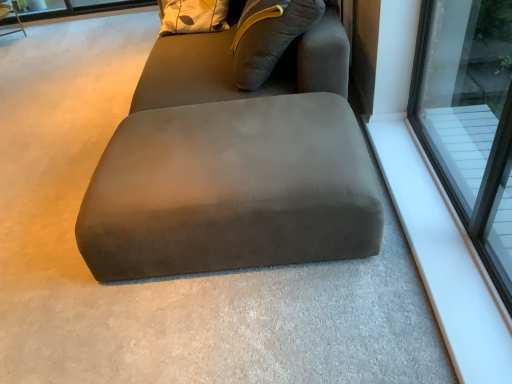
Describe the element at coordinates (232, 67) in the screenshot. I see `suede gray bean bag at center` at that location.

What is the approximate height of wooden swivel chair at upper left?

It is 12.11 inches.

In order to face transparent glass window at upper right, should I rotate leftwards or rightwards?

You should look right and rotate roughly 27.171 degrees.

Find the location of a particular element. This screenshot has height=384, width=512. white smooth window sill at upper right is located at coordinates (x=444, y=256).

Measure the distance between transparent glass window at upper right and wooden swivel chair at upper left.

transparent glass window at upper right and wooden swivel chair at upper left are 13.77 feet apart from each other.

Relative to wooden swivel chair at upper left, is transparent glass window at upper right in front or behind?

In the image, transparent glass window at upper right appears in front of wooden swivel chair at upper left.

Can you tell me how much transparent glass window at upper right and wooden swivel chair at upper left differ in facing direction?

The angle between the facing direction of transparent glass window at upper right and the facing direction of wooden swivel chair at upper left is 90.6 degrees.

Is transparent glass window at upper right far from wooden swivel chair at upper left?

Indeed, transparent glass window at upper right is not near wooden swivel chair at upper left.

Does wooden swivel chair at upper left have a smaller size compared to suede gray bean bag at center?

Yes.

Considering the sizes of wooden swivel chair at upper left and suede gray bean bag at center in the image, is wooden swivel chair at upper left wider or thinner than suede gray bean bag at center?

Considering their sizes, wooden swivel chair at upper left looks slimmer than suede gray bean bag at center.

Looking at this image, from the image's perspective, is wooden swivel chair at upper left above or below suede gray bean bag at center?

Based on their image positions, wooden swivel chair at upper left is located above suede gray bean bag at center.

Relative to suede gray bean bag at center, is wooden swivel chair at upper left in front or behind?

Clearly, wooden swivel chair at upper left is behind suede gray bean bag at center.

From a real-world perspective, is transparent glass window at upper right located beneath suede gray bean bag at center?

No, from a real-world perspective, transparent glass window at upper right is not below suede gray bean bag at center.

Would you consider transparent glass window at upper right to be distant from suede gray bean bag at center?

No.

Does point (505, 190) come behind point (343, 84)?

No, (505, 190) is closer to viewer.

From the image's perspective, is transparent glass window at upper right on top of suede gray bean bag at center?

No, from the image's perspective, transparent glass window at upper right is not above suede gray bean bag at center.

Is transparent glass window at upper right further to the viewer compared to suede ottoman at center?

No.

From the image's perspective, which object appears higher, transparent glass window at upper right or suede ottoman at center?

transparent glass window at upper right, from the image's perspective.

Based on the photo, do you think transparent glass window at upper right is within suede ottoman at center, or outside of it?

transparent glass window at upper right is located beyond the bounds of suede ottoman at center.

Is transparent glass window at upper right bigger or smaller than suede ottoman at center?

Considering their sizes, transparent glass window at upper right takes up less space than suede ottoman at center.

Considering the positions of points (434, 180) and (232, 230), is point (434, 180) farther from camera compared to point (232, 230)?

Yes, it is behind point (232, 230).

Looking at their sizes, would you say white smooth window sill at upper right is wider or thinner than suede ottoman at center?

white smooth window sill at upper right is thinner than suede ottoman at center.

Is the surface of white smooth window sill at upper right in direct contact with suede ottoman at center?

No, white smooth window sill at upper right is not with suede ottoman at center.

From the image's perspective, does white smooth window sill at upper right appear lower than suede ottoman at center?

Correct, white smooth window sill at upper right appears lower than suede ottoman at center in the image.

Is suede ottoman at center at the back of wooden swivel chair at upper left?

No, wooden swivel chair at upper left is not facing the opposite direction of suede ottoman at center.

Choose the correct answer: Is wooden swivel chair at upper left inside suede ottoman at center or outside it?

wooden swivel chair at upper left lies outside suede ottoman at center.

Considering the sizes of objects wooden swivel chair at upper left and suede ottoman at center in the image provided, who is bigger, wooden swivel chair at upper left or suede ottoman at center?

suede ottoman at center is bigger.

How far apart are white smooth window sill at upper right and wooden swivel chair at upper left?

They are 14.29 feet apart.

Which is in front, white smooth window sill at upper right or wooden swivel chair at upper left?

white smooth window sill at upper right is in front.

Is white smooth window sill at upper right smaller than wooden swivel chair at upper left?

Correct, white smooth window sill at upper right occupies less space than wooden swivel chair at upper left.

Is wooden swivel chair at upper left at the back of white smooth window sill at upper right?

white smooth window sill at upper right does not have its back to wooden swivel chair at upper left.

You are a GUI agent. You are given a task and a screenshot of the screen. Output one action in this format:
    pyautogui.click(x=<x>, y=<y>)
    Task: Click on the window below the wooden swivel chair at upper left (from the image's perspective)
    This screenshot has width=512, height=384.
    Given the screenshot: What is the action you would take?
    pyautogui.click(x=469, y=119)

You are a GUI agent. You are given a task and a screenshot of the screen. Output one action in this format:
    pyautogui.click(x=<x>, y=<y>)
    Task: Click on the swivel chair that appears behind the suede gray bean bag at center
    Image resolution: width=512 pixels, height=384 pixels.
    Given the screenshot: What is the action you would take?
    pyautogui.click(x=8, y=14)

Considering their positions, is transparent glass window at upper right positioned closer to suede ottoman at center than suede gray bean bag at center?

suede gray bean bag at center is positioned closer to the anchor suede ottoman at center.

Which object lies further to the anchor point white smooth window sill at upper right, transparent glass window at upper right or wooden swivel chair at upper left?

Among the two, wooden swivel chair at upper left is located further to white smooth window sill at upper right.

Considering their positions, is transparent glass window at upper right positioned further to suede gray bean bag at center than white smooth window sill at upper right?

white smooth window sill at upper right is further to suede gray bean bag at center.

From the picture: Considering their positions, is suede ottoman at center positioned further to suede gray bean bag at center than wooden swivel chair at upper left?

wooden swivel chair at upper left is further to suede gray bean bag at center.

Estimate the real-world distances between objects in this image. Which object is further from white smooth window sill at upper right, suede gray bean bag at center or wooden swivel chair at upper left?

wooden swivel chair at upper left is further to white smooth window sill at upper right.

Considering their positions, is suede gray bean bag at center positioned closer to suede ottoman at center than white smooth window sill at upper right?

Based on the image, suede gray bean bag at center appears to be nearer to suede ottoman at center.

Looking at the image, which one is located closer to suede ottoman at center, wooden swivel chair at upper left or suede gray bean bag at center?

Based on the image, suede gray bean bag at center appears to be nearer to suede ottoman at center.

Based on their spatial positions, is white smooth window sill at upper right or wooden swivel chair at upper left closer to transparent glass window at upper right?

white smooth window sill at upper right is positioned closer to the anchor transparent glass window at upper right.

Locate an element on the screen. This screenshot has width=512, height=384. window sill situated between suede ottoman at center and transparent glass window at upper right from left to right is located at coordinates (444, 256).

Identify the location of bean bag chair between wooden swivel chair at upper left and suede ottoman at center from left to right. (232, 67).

Where is `bean bag chair located between wooden swivel chair at upper left and transparent glass window at upper right in the left-right direction`? bean bag chair located between wooden swivel chair at upper left and transparent glass window at upper right in the left-right direction is located at coordinates (232, 67).

The image size is (512, 384). I want to click on studio couch between wooden swivel chair at upper left and white smooth window sill at upper right in the horizontal direction, so click(233, 165).